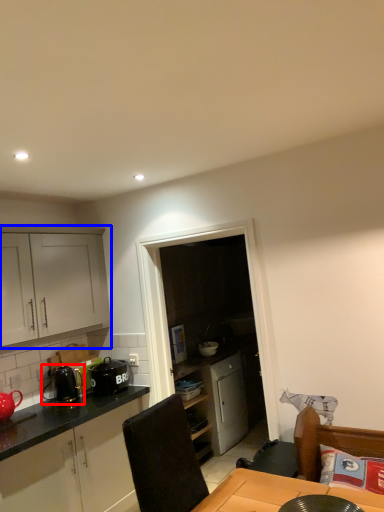
Question: Which point is further to the camera, appliance (highlighted by a red box) or cabinetry (highlighted by a blue box)?

Choices:
 (A) appliance
 (B) cabinetry

Answer: (A)